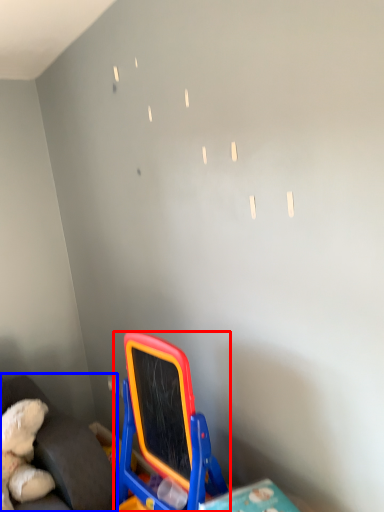
Question: Which point is closer to the camera, toy (highlighted by a red box) or furniture (highlighted by a blue box)?

Choices:
 (A) toy
 (B) furniture

Answer: (A)